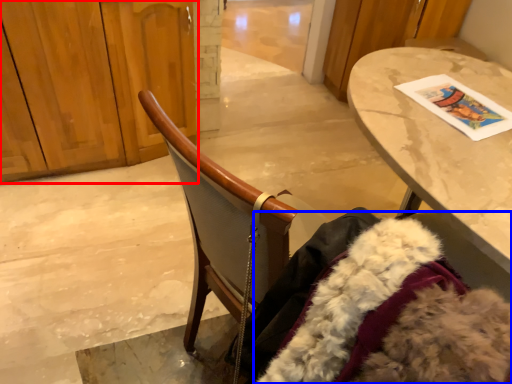
Question: Which object is closer to the camera taking this photo, dresser (highlighted by a red box) or fur coat (highlighted by a blue box)?

Choices:
 (A) dresser
 (B) fur coat

Answer: (B)